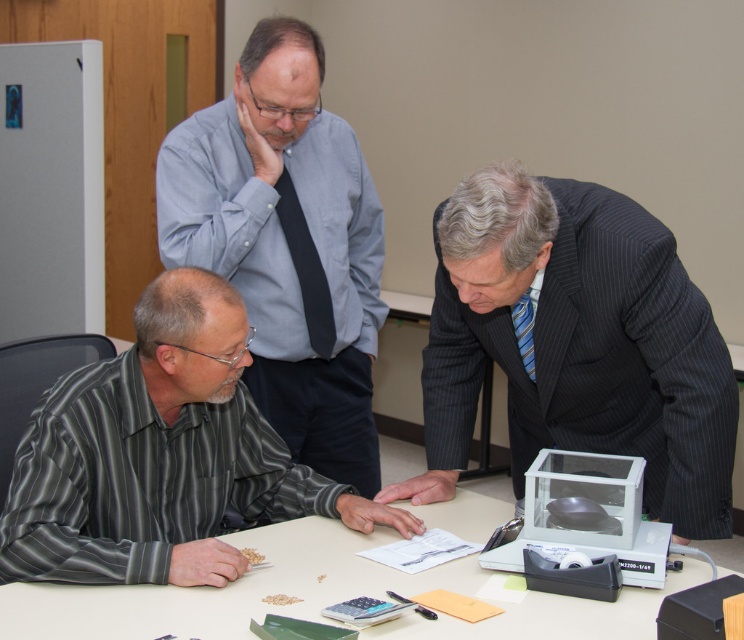
Can you confirm if light blue shirt at upper center is positioned to the right of white plastic table at center?

No, light blue shirt at upper center is not to the right of white plastic table at center.

Can you confirm if light blue shirt at upper center is wider than white plastic table at center?

No, light blue shirt at upper center is not wider than white plastic table at center.

Who is more distant from viewer, (301, 342) or (507, 627)?

The point (301, 342) is more distant.

This screenshot has height=640, width=744. In order to click on light blue shirt at upper center in this screenshot , I will do `click(286, 244)`.

The width and height of the screenshot is (744, 640). Describe the element at coordinates (286, 244) in the screenshot. I see `light blue shirt at upper center` at that location.

Does light blue shirt at upper center lie in front of blue striped tie at right?

No, it is not.

Does point (279, 378) come farther from viewer compared to point (525, 294)?

Yes, point (279, 378) is farther from viewer.

The width and height of the screenshot is (744, 640). I want to click on light blue shirt at upper center, so click(286, 244).

In the scene shown: Measure the distance between gray striped shirt at lower left and camera.

gray striped shirt at lower left is 1.31 meters away from camera.

Can you confirm if gray striped shirt at lower left is positioned above white plastic table at center?

Indeed, gray striped shirt at lower left is positioned over white plastic table at center.

Does point (4, 548) lie behind point (426, 580)?

That is False.

You are a GUI agent. You are given a task and a screenshot of the screen. Output one action in this format:
    pyautogui.click(x=<x>, y=<y>)
    Task: Click on the gray striped shirt at lower left
    Image resolution: width=744 pixels, height=640 pixels.
    Given the screenshot: What is the action you would take?
    tap(161, 456)